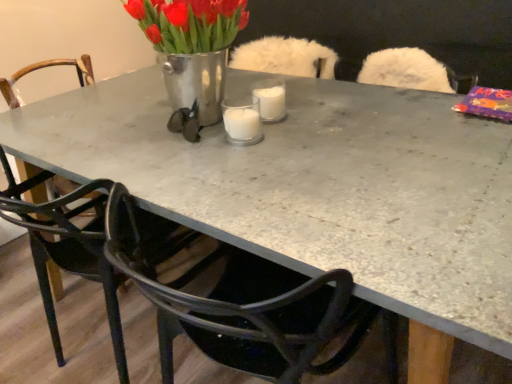
Question: Is metallic vase at center wider or thinner than black plastic chair at lower left, which is the first chair from right to left?

Choices:
 (A) wide
 (B) thin

Answer: (B)

Question: Would you say metallic vase at center is inside or outside black plastic chair at lower left, positioned as the second chair in left-to-right order?

Choices:
 (A) inside
 (B) outside

Answer: (B)

Question: Considering the real-world distances, which object is closest to the black plastic chair at lower left, which is the first chair from right to left?

Choices:
 (A) black metal chair at center, arranged as the first chair when viewed from the left
 (B) clear glass candle at center
 (C) metallic vase at center

Answer: (A)

Question: Estimate the real-world distances between objects in this image. Which object is farther from the black metal chair at center, arranged as the first chair when viewed from the left?

Choices:
 (A) metallic vase at center
 (B) black plastic chair at lower left, which is the first chair from right to left
 (C) clear glass candle at center

Answer: (C)